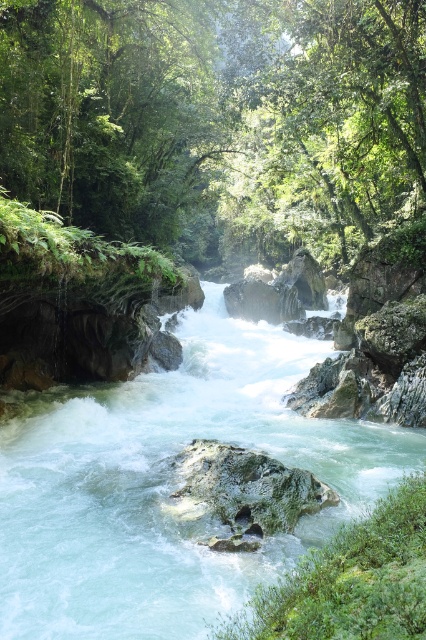
Question: Based on their relative distances, which object is nearer to the translucent white water at center?

Choices:
 (A) green mossy rock at center
 (B) green leafy tree at center

Answer: (A)

Question: Is green leafy tree at center closer to the viewer compared to translucent white water at center?

Choices:
 (A) no
 (B) yes

Answer: (A)

Question: Can you confirm if green leafy tree at center is positioned below green mossy rock at center?

Choices:
 (A) yes
 (B) no

Answer: (B)

Question: Which object appears farthest from the camera in this image?

Choices:
 (A) green leafy tree at center
 (B) green mossy rock at center

Answer: (A)

Question: Is green leafy tree at center positioned at the back of green mossy rock at center?

Choices:
 (A) no
 (B) yes

Answer: (B)

Question: Which of the following is the closest to the observer?

Choices:
 (A) green mossy rock at center
 (B) green leafy tree at center
 (C) translucent white water at center

Answer: (C)